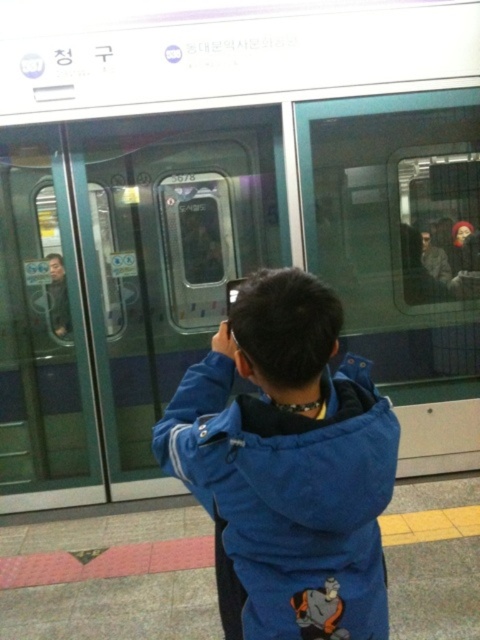
You are a delivery robot with a box that is 3 meters long. You need to move from the blue fabric jacket at center to the matte black jacket at left. Is there enough space between them to move the box without tilting it sideways?

The blue fabric jacket at center and the matte black jacket at left are 2.82 meters apart. Since the box is 3 meters long, there isn not enough space to move the box without tilting it sideways.

You are a photographer trying to capture the scene of the subway platform. You notice the matte black jacket at left and the black plastic phone at upper center. Which object is positioned more to the left side of the image?

The matte black jacket at left is positioned more to the left side of the image compared to the black plastic phone at upper center.

You are a photographer standing on the subway platform. You notice the blue fabric jacket at center and the black plastic phone at upper center. Which object is positioned to the right of the other?

The blue fabric jacket at center is to the right of the black plastic phone at upper center.